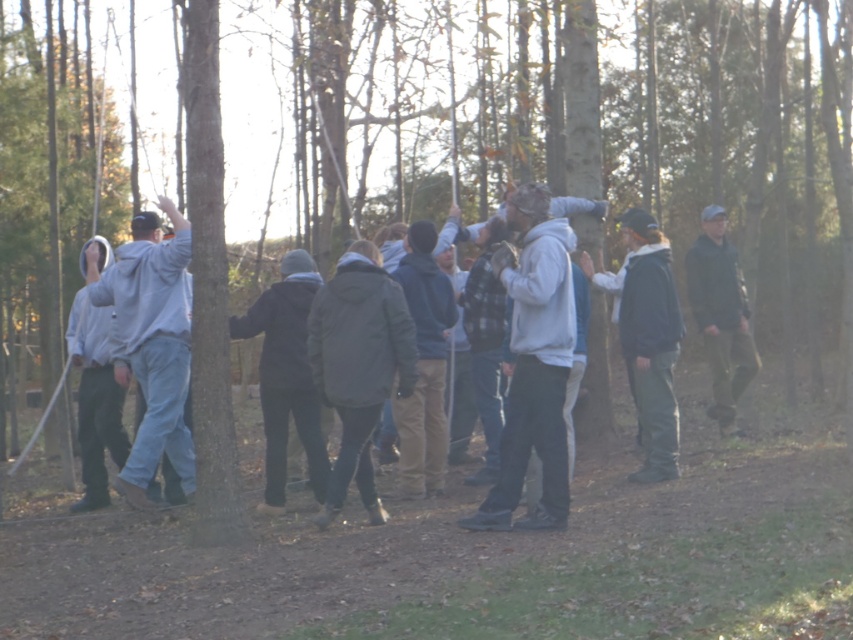
You are a photographer positioned behind the group and want to capture both the matte gray hoodie at center and the dark green fabric jacket at right in the same frame. Which person should you focus on first to ensure both are in focus?

You should focus on the matte gray hoodie at center first because it is closer to you than the dark green fabric jacket at right, so focusing on the closer object will help both be in focus.

You are planning to borrow a jacket from a friend who is wearing either the matte gray hoodie at center or the dark green fabric jacket at right. If you want the bigger one, which one should you choose?

The matte gray hoodie at center has a larger size compared to the dark green fabric jacket at right, so you should choose the matte gray hoodie at center.